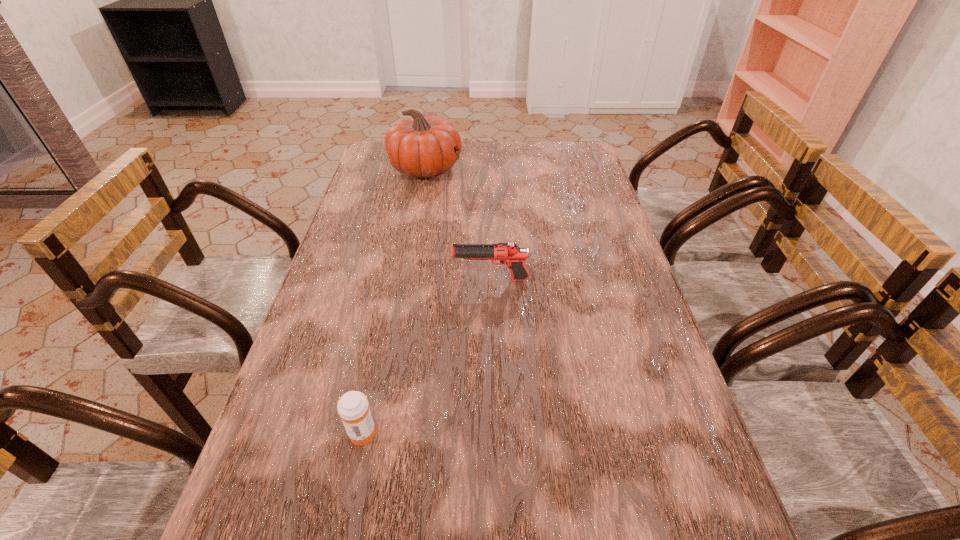
Find the location of a particular element. This screenshot has width=960, height=540. vacant area that lies between the pumpkin and the second nearest object is located at coordinates (458, 224).

This screenshot has width=960, height=540. Identify the location of vacant space that is in between the gun and the nearest object. (426, 356).

Image resolution: width=960 pixels, height=540 pixels. Find the location of `empty space that is in between the pumpkin and the second nearest object`. empty space that is in between the pumpkin and the second nearest object is located at coordinates (458, 224).

Find the location of `unoccupied area between the pumpkin and the gun`. unoccupied area between the pumpkin and the gun is located at coordinates (458, 224).

The height and width of the screenshot is (540, 960). I want to click on the closest object to the tallest object, so click(x=508, y=253).

You are a GUI agent. You are given a task and a screenshot of the screen. Output one action in this format:
    pyautogui.click(x=<x>, y=<y>)
    Task: Click on the object that is the closest to the second farthest object
    
    Given the screenshot: What is the action you would take?
    pyautogui.click(x=353, y=408)